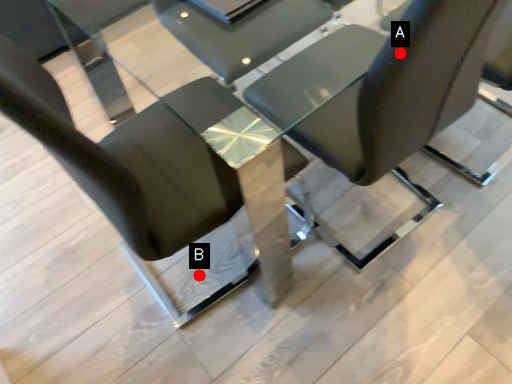
Question: Two points are circled on the image, labeled by A and B beside each circle. Which point is closer to the camera?

Choices:
 (A) A is closer
 (B) B is closer

Answer: (A)